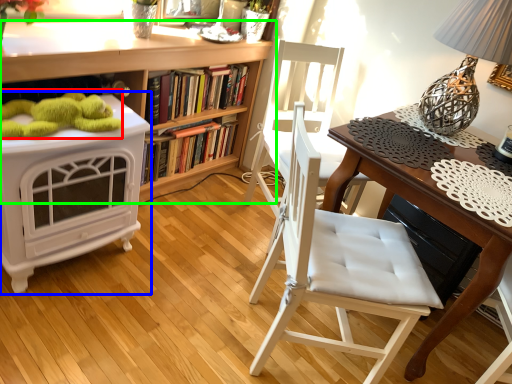
Question: Estimate the real-world distances between objects in this image. Which object is farther from toy (highlighted by a red box), vanity (highlighted by a blue box) or bookcase (highlighted by a green box)?

Choices:
 (A) vanity
 (B) bookcase

Answer: (B)